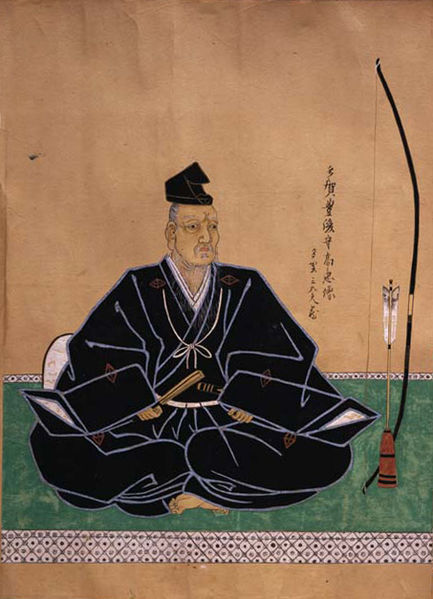
Where is `beige wall`? The height and width of the screenshot is (599, 433). beige wall is located at coordinates (91, 155).